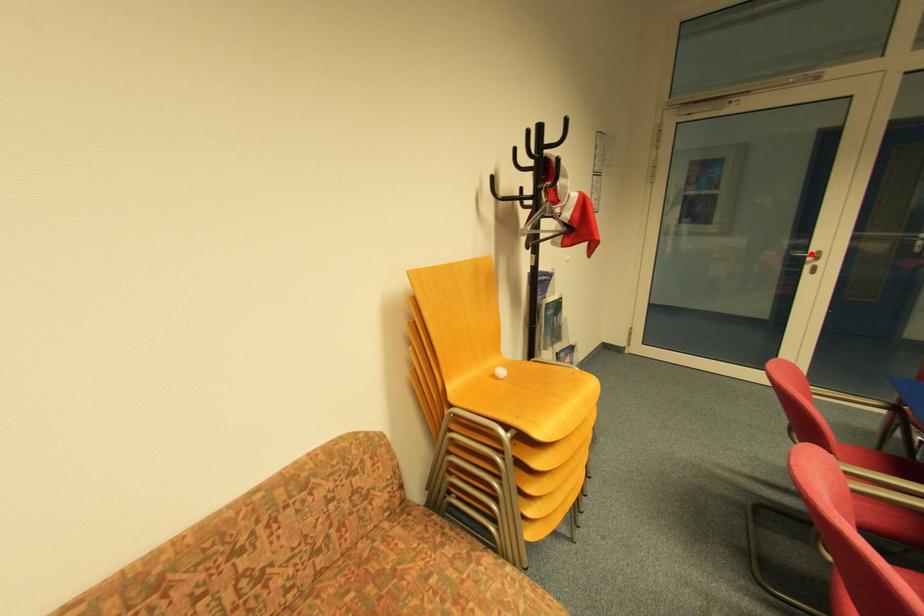
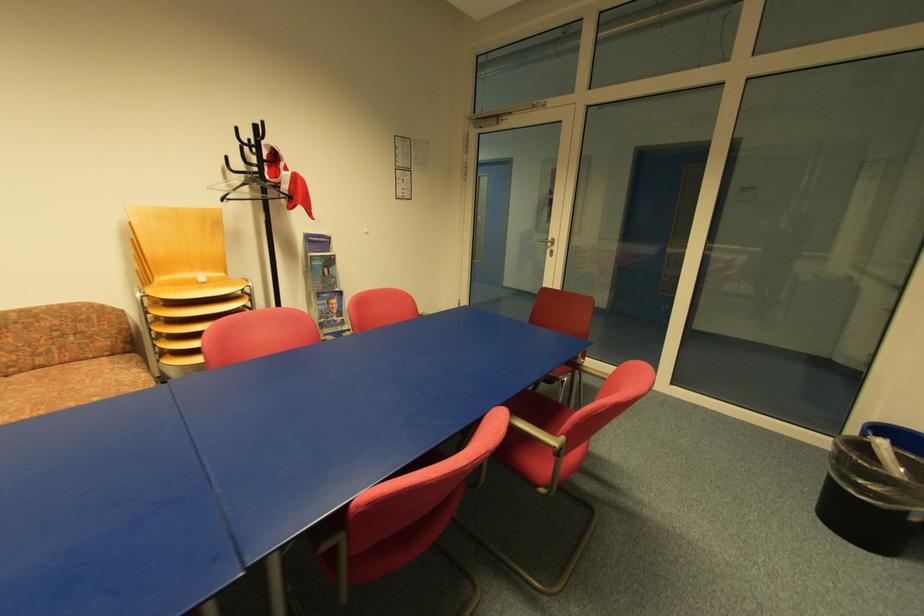
Locate, in the second image, the point that corresponds to the highlighted location in the first image.

(551, 241)